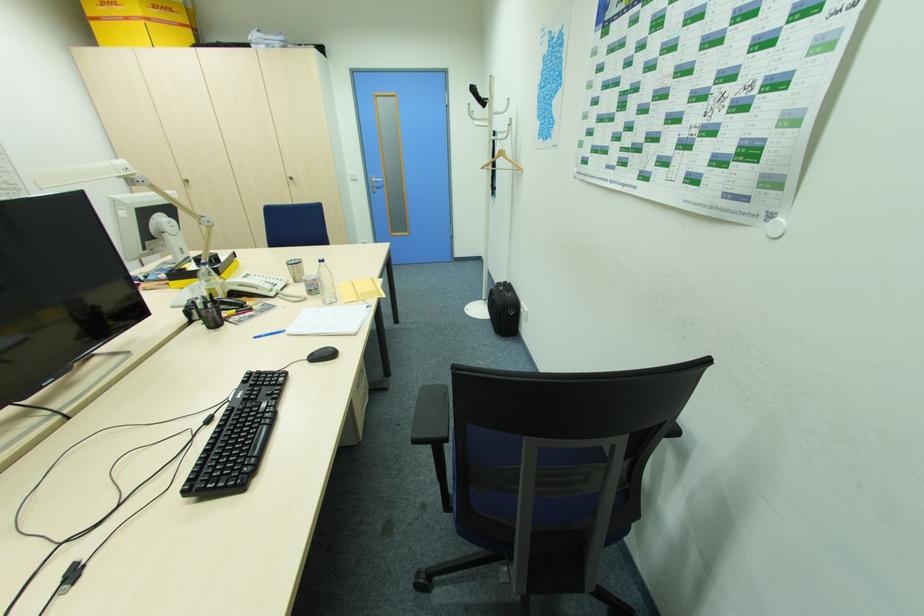
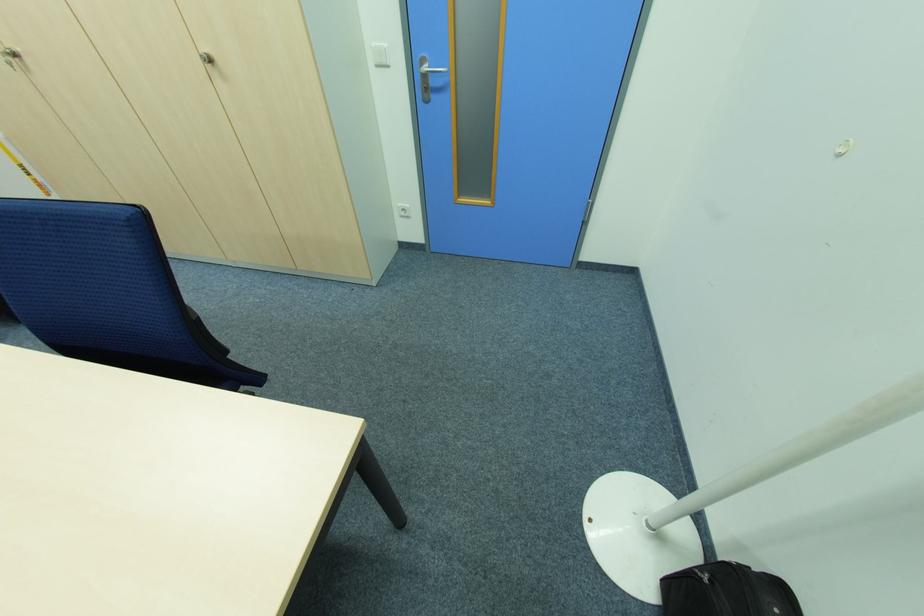
The point at (x=295, y=179) is marked in the first image. Where is the corresponding point in the second image?

(213, 62)